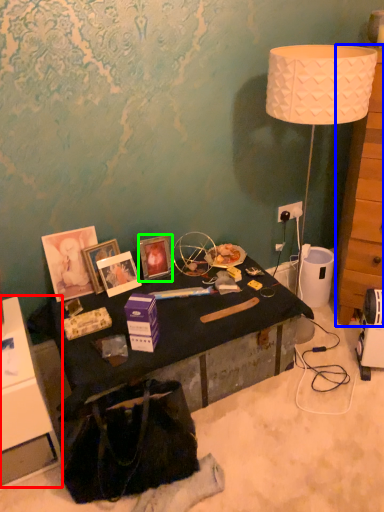
Question: Which object is positioned farthest from cabinetry (highlighted by a red box)? Select from dresser (highlighted by a blue box) and picture frame (highlighted by a green box).

Choices:
 (A) dresser
 (B) picture frame

Answer: (A)